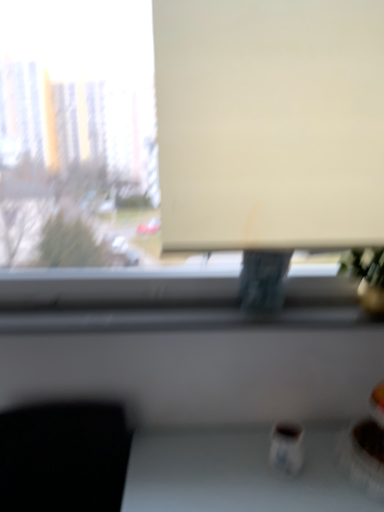
Question: Is the position of matte white screen at center less distant than that of white matte window at upper center?

Choices:
 (A) no
 (B) yes

Answer: (A)

Question: Does matte white screen at center turn towards white matte window at upper center?

Choices:
 (A) no
 (B) yes

Answer: (B)

Question: Is matte white screen at center to the right of white matte window at upper center from the viewer's perspective?

Choices:
 (A) no
 (B) yes

Answer: (B)

Question: Considering the relative sizes of matte white screen at center and white matte window at upper center in the image provided, is matte white screen at center thinner than white matte window at upper center?

Choices:
 (A) yes
 (B) no

Answer: (A)

Question: Is matte white screen at center outside of white matte window at upper center?

Choices:
 (A) no
 (B) yes

Answer: (A)

Question: From a real-world perspective, is matte white screen at center beneath white matte window at upper center?

Choices:
 (A) yes
 (B) no

Answer: (B)

Question: Is white matte window at upper center oriented towards matte white screen at center?

Choices:
 (A) no
 (B) yes

Answer: (B)

Question: From a real-world perspective, does white matte window at upper center sit lower than matte white screen at center?

Choices:
 (A) yes
 (B) no

Answer: (A)

Question: Is matte white screen at center completely or partially inside white matte window at upper center?

Choices:
 (A) yes
 (B) no

Answer: (A)

Question: Does white matte window at upper center have a greater height compared to matte white screen at center?

Choices:
 (A) no
 (B) yes

Answer: (B)

Question: Does white matte window at upper center come behind matte white screen at center?

Choices:
 (A) no
 (B) yes

Answer: (A)

Question: Considering the relative positions of white matte window at upper center and matte white screen at center in the image provided, is white matte window at upper center to the left of matte white screen at center from the viewer's perspective?

Choices:
 (A) yes
 (B) no

Answer: (A)

Question: Looking at their shapes, would you say white matte window at upper center is wider or thinner than matte white screen at center?

Choices:
 (A) thin
 (B) wide

Answer: (B)